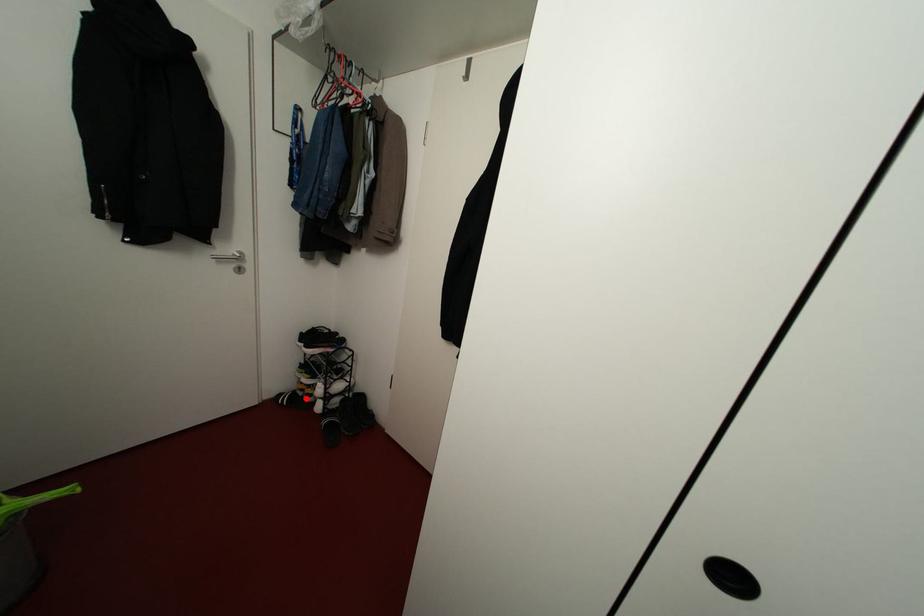
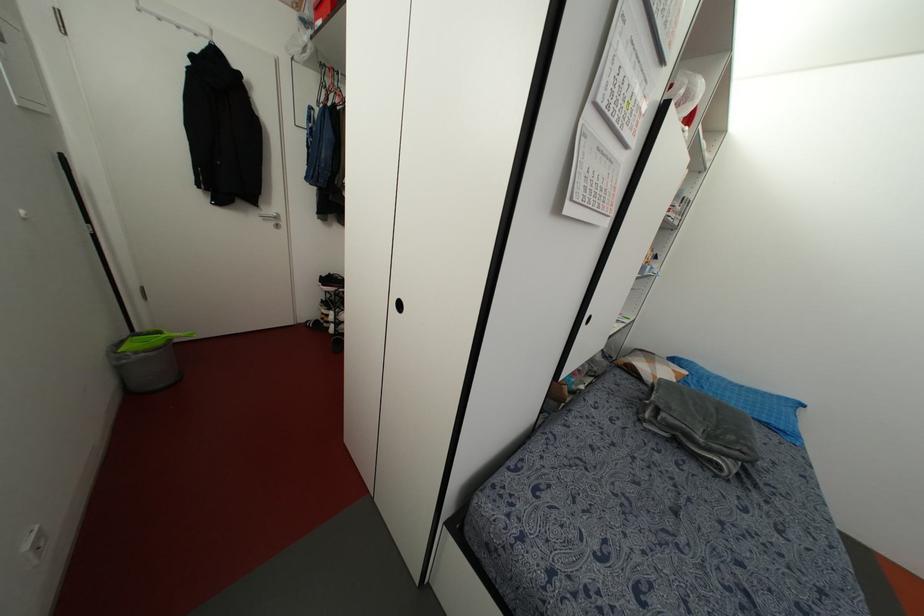
Question: I am providing you with two images of the same scene from different viewpoints. In image1, a red point is highlighted. Considering the same 3D point in image2, which of the following is correct?

Choices:
 (A) It is closer
 (B) It is farther

Answer: (B)